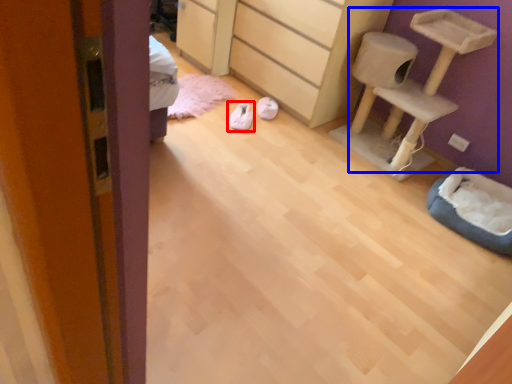
Question: Which object is further to the camera taking this photo, footwear (highlighted by a red box) or furniture (highlighted by a blue box)?

Choices:
 (A) footwear
 (B) furniture

Answer: (A)